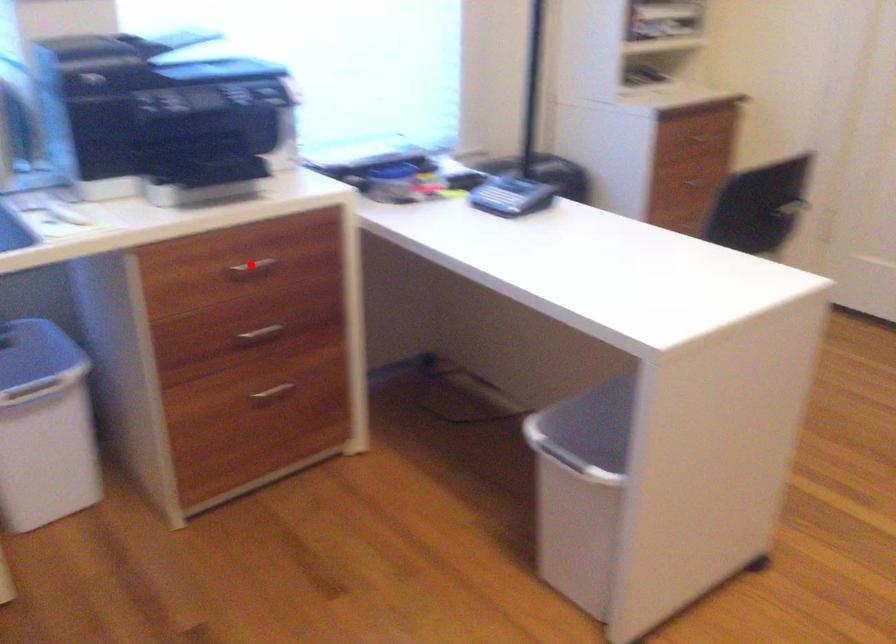
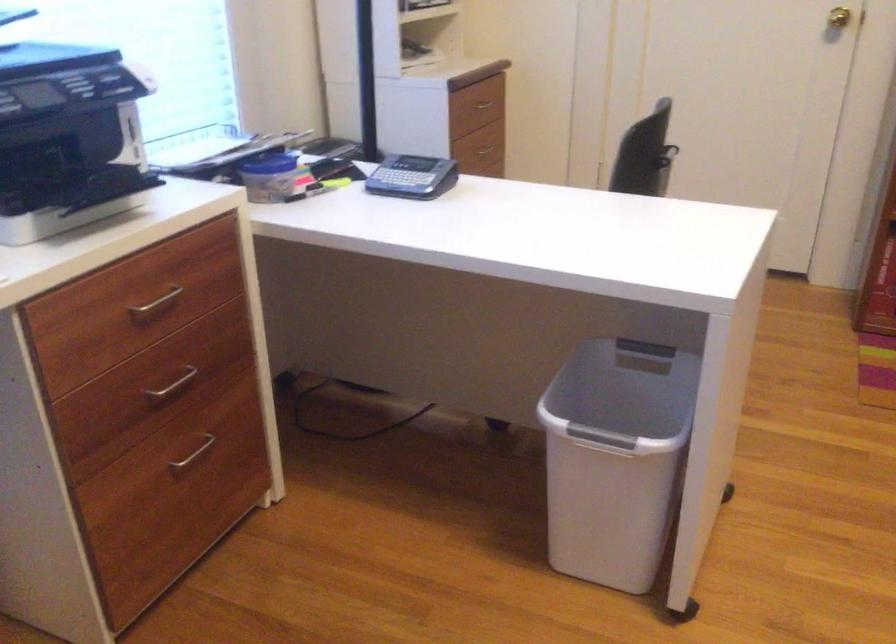
Question: I am providing you with two images of the same scene from different viewpoints. Given a red point in image1, look at the same physical point in image2. Is it:

Choices:
 (A) Closer to the viewpoint
 (B) Farther from the viewpoint

Answer: (A)